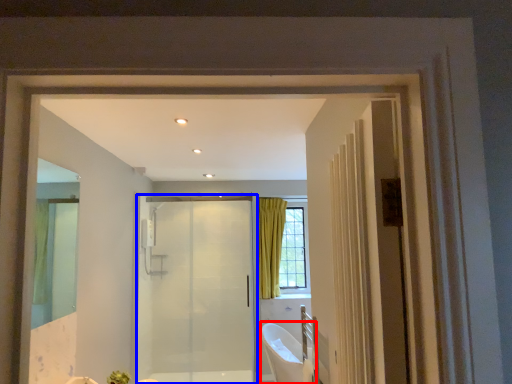
Question: Which object is further to the camera taking this photo, bath (highlighted by a red box) or door (highlighted by a blue box)?

Choices:
 (A) bath
 (B) door

Answer: (B)